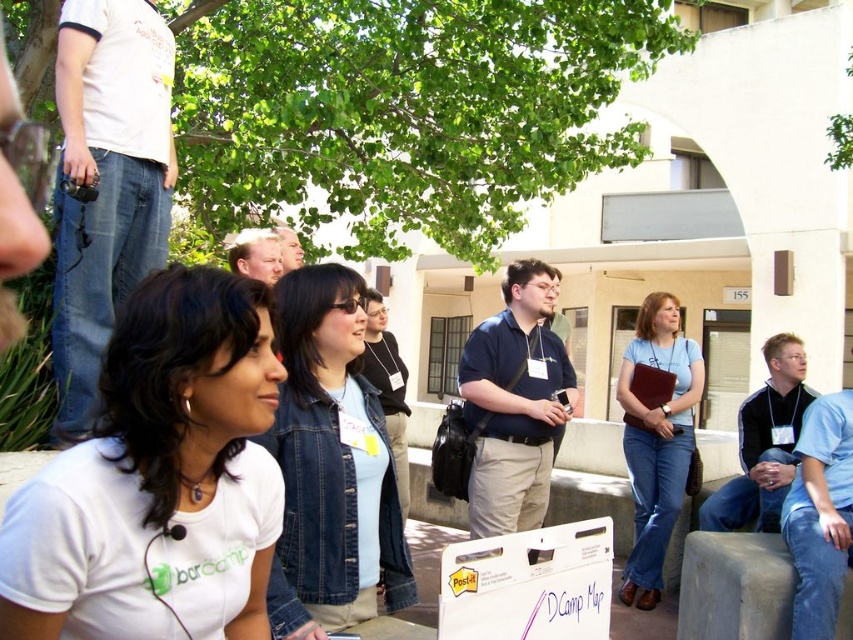
This screenshot has width=853, height=640. Find the location of `denim jacket at center`. denim jacket at center is located at coordinates (329, 465).

Does point (372, 509) come closer to viewer compared to point (668, 310)?

Yes, point (372, 509) is closer to viewer.

This screenshot has width=853, height=640. Identify the location of denim jacket at center. (329, 465).

Who is higher up, white matte shirt at lower left or denim jacket at center?

Positioned higher is white matte shirt at lower left.

The image size is (853, 640). What do you see at coordinates (154, 464) in the screenshot?
I see `white matte shirt at lower left` at bounding box center [154, 464].

The image size is (853, 640). Describe the element at coordinates (154, 464) in the screenshot. I see `white matte shirt at lower left` at that location.

The width and height of the screenshot is (853, 640). Identify the location of white matte shirt at lower left. (154, 464).

Does point (164, 476) lie behind point (683, 396)?

No.

Which is below, white matte shirt at lower left or blue jeans at center?

blue jeans at center

Find the location of a particular element. This screenshot has height=640, width=853. white matte shirt at lower left is located at coordinates (154, 464).

This screenshot has width=853, height=640. I want to click on white matte shirt at lower left, so click(x=154, y=464).